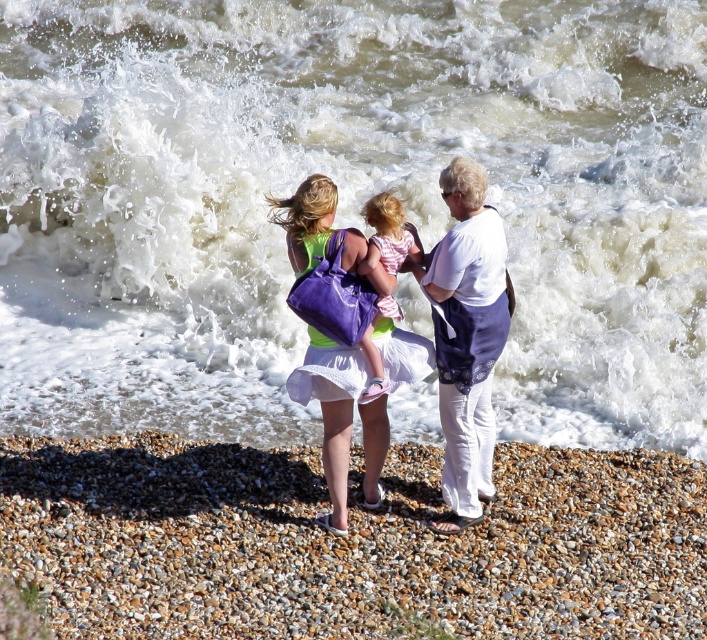
Is smooth pebbles at lower center wider than matte purple bag at center?

Yes, smooth pebbles at lower center is wider than matte purple bag at center.

Is smooth pebbles at lower center bigger than matte purple bag at center?

Indeed, smooth pebbles at lower center has a larger size compared to matte purple bag at center.

The width and height of the screenshot is (707, 640). Describe the element at coordinates (349, 541) in the screenshot. I see `smooth pebbles at lower center` at that location.

Locate an element on the screen. smooth pebbles at lower center is located at coordinates (349, 541).

Which is more to the left, smooth pebbles at lower center or pink striped dress at center?

From the viewer's perspective, pink striped dress at center appears more on the left side.

Who is shorter, smooth pebbles at lower center or pink striped dress at center?

smooth pebbles at lower center

Between point (438, 621) and point (380, 250), which one is positioned behind?

Positioned behind is point (380, 250).

Identify the location of smooth pebbles at lower center. The height and width of the screenshot is (640, 707). (349, 541).

Which is in front, point (373, 74) or point (327, 538)?

Point (327, 538) is more forward.

The height and width of the screenshot is (640, 707). I want to click on white frothy water at center, so click(346, 202).

Locate an element on the screen. white frothy water at center is located at coordinates (346, 202).